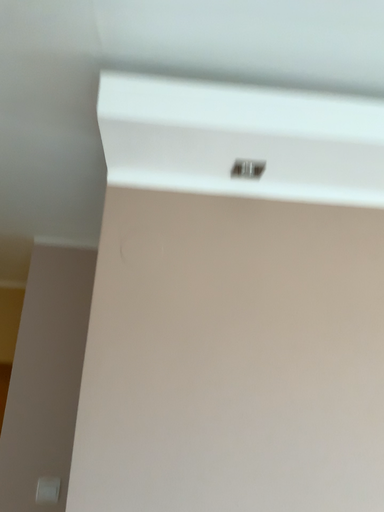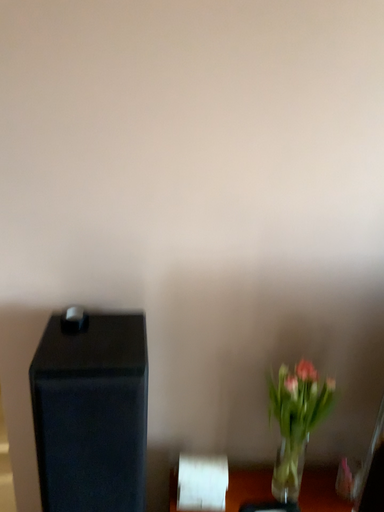
Question: How did the camera likely rotate when shooting the video?

Choices:
 (A) rotated upward
 (B) rotated downward

Answer: (B)